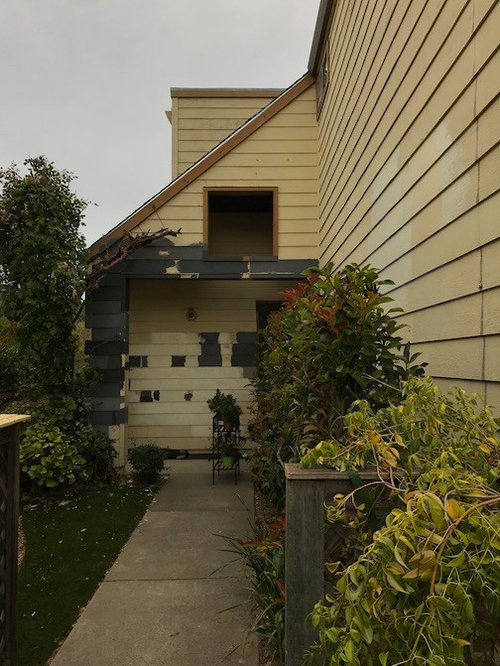
Where is `green leafy plant`? This screenshot has height=666, width=500. green leafy plant is located at coordinates (429, 519).